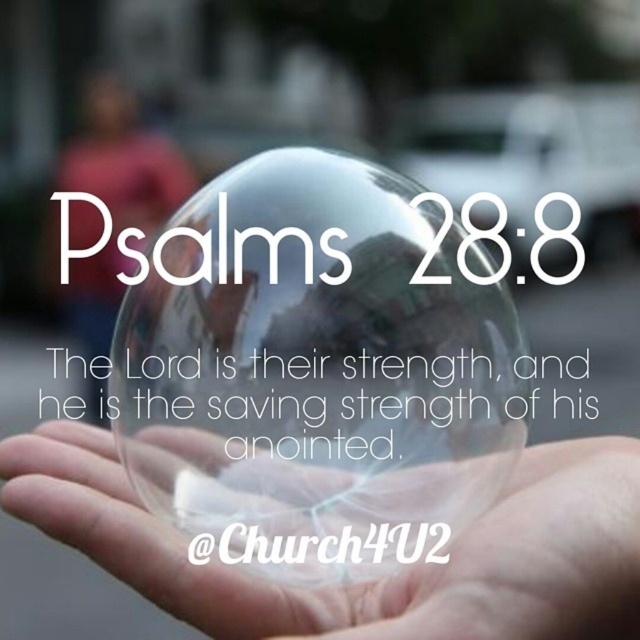
Question: Is transparent glass sphere at center further to camera compared to transparent glass bubble at center?

Choices:
 (A) no
 (B) yes

Answer: (B)

Question: Which of these objects is positioned farthest from the matte pink shirt at upper left?

Choices:
 (A) transparent glass sphere at center
 (B) transparent glass bubble at center

Answer: (A)

Question: Can you confirm if transparent glass sphere at center is smaller than transparent glass bubble at center?

Choices:
 (A) no
 (B) yes

Answer: (B)

Question: Is transparent glass bubble at center positioned behind matte pink shirt at upper left?

Choices:
 (A) yes
 (B) no

Answer: (B)

Question: Which of the following is the farthest from the observer?

Choices:
 (A) (396, 445)
 (B) (116, 284)

Answer: (B)

Question: Estimate the real-world distances between objects in this image. Which object is closer to the transparent glass bubble at center?

Choices:
 (A) matte pink shirt at upper left
 (B) transparent glass sphere at center

Answer: (B)